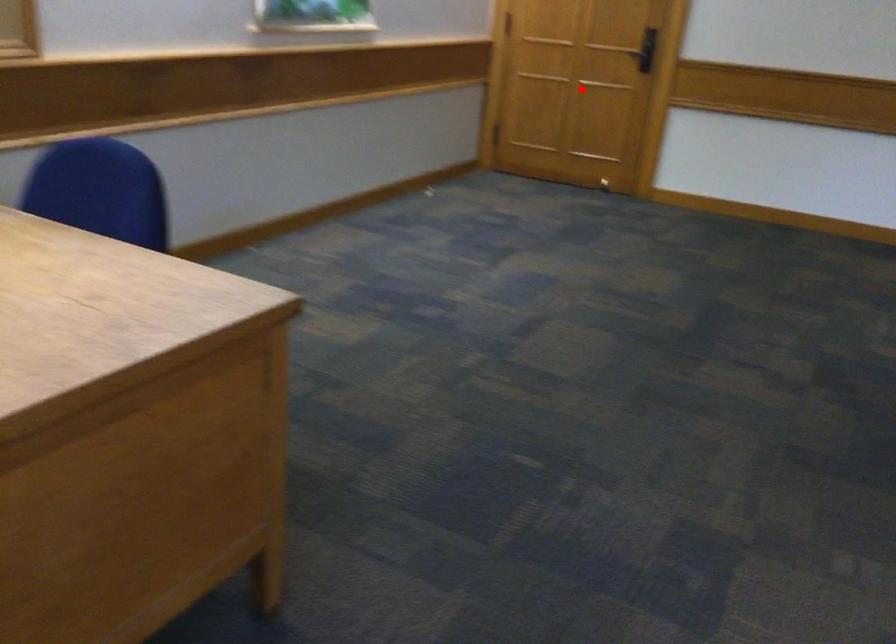
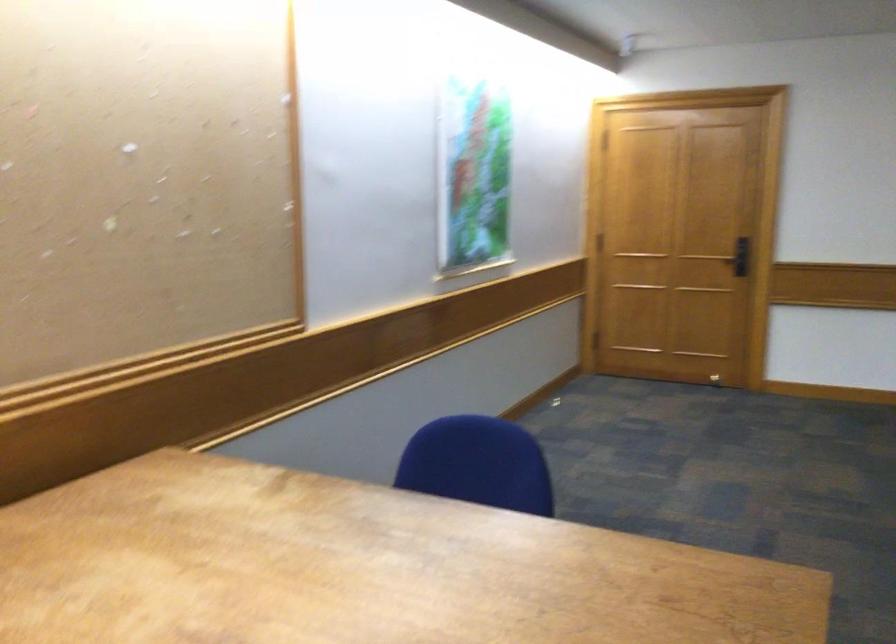
Question: I am providing you with two images of the same scene from different viewpoints. A red point is marked on the first image. At the location where the point appears in image 1, is it still visible in image 2?

Choices:
 (A) Yes
 (B) No

Answer: (B)